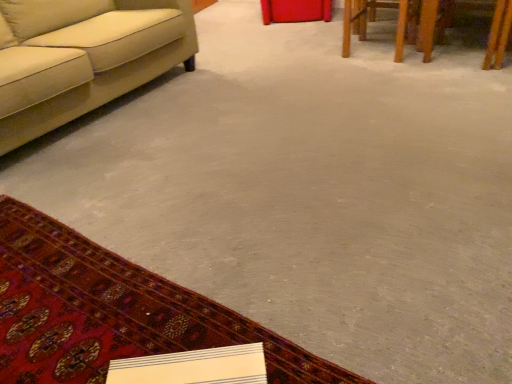
Question: Does beige fabric couch at left have a lesser width compared to wooden table at upper right?

Choices:
 (A) yes
 (B) no

Answer: (B)

Question: Is beige fabric couch at left taller than wooden table at upper right?

Choices:
 (A) no
 (B) yes

Answer: (B)

Question: Are beige fabric couch at left and wooden table at upper right located far from each other?

Choices:
 (A) yes
 (B) no

Answer: (A)

Question: From a real-world perspective, is beige fabric couch at left positioned under wooden table at upper right based on gravity?

Choices:
 (A) yes
 (B) no

Answer: (B)

Question: From the image's perspective, is beige fabric couch at left below wooden table at upper right?

Choices:
 (A) no
 (B) yes

Answer: (B)

Question: Is beige fabric couch at left at the left side of wooden table at upper right?

Choices:
 (A) yes
 (B) no

Answer: (A)

Question: Could you tell me if wooden table at upper right is turned towards beige fabric couch at left?

Choices:
 (A) yes
 (B) no

Answer: (B)

Question: Does wooden table at upper right appear on the right side of beige fabric couch at left?

Choices:
 (A) no
 (B) yes

Answer: (B)

Question: Does wooden table at upper right have a greater height compared to beige fabric couch at left?

Choices:
 (A) no
 (B) yes

Answer: (A)

Question: Is wooden table at upper right outside beige fabric couch at left?

Choices:
 (A) no
 (B) yes

Answer: (B)

Question: Considering the relative sizes of wooden table at upper right and beige fabric couch at left in the image provided, is wooden table at upper right wider than beige fabric couch at left?

Choices:
 (A) no
 (B) yes

Answer: (A)

Question: From the image's perspective, is wooden table at upper right on beige fabric couch at left?

Choices:
 (A) yes
 (B) no

Answer: (A)

Question: From a real-world perspective, does wooden table at upper right stand above carpeted mat at lower left?

Choices:
 (A) yes
 (B) no

Answer: (A)